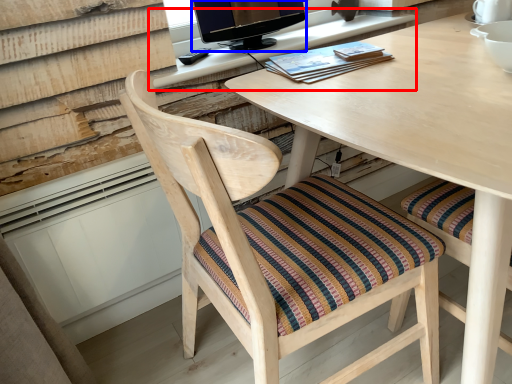
Question: Which object appears closest to the camera in this image, computer desk (highlighted by a red box) or television (highlighted by a blue box)?

Choices:
 (A) computer desk
 (B) television

Answer: (A)